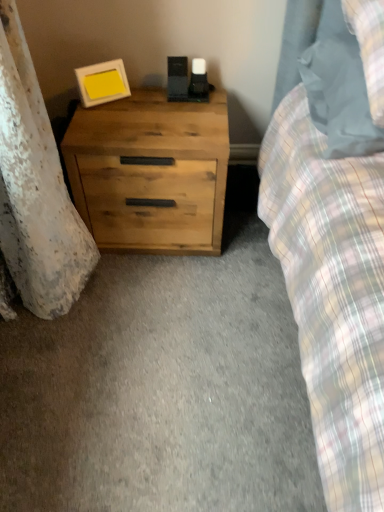
Question: From a real-world perspective, is matte gray pillow at upper right physically below natural wood chest of drawers at lower left?

Choices:
 (A) yes
 (B) no

Answer: (B)

Question: Considering the relative sizes of matte gray pillow at upper right and natural wood chest of drawers at lower left in the image provided, is matte gray pillow at upper right smaller than natural wood chest of drawers at lower left?

Choices:
 (A) no
 (B) yes

Answer: (B)

Question: From the image's perspective, does matte gray pillow at upper right appear lower than natural wood chest of drawers at lower left?

Choices:
 (A) yes
 (B) no

Answer: (B)

Question: Is matte gray pillow at upper right shorter than natural wood chest of drawers at lower left?

Choices:
 (A) yes
 (B) no

Answer: (A)

Question: Is there a large distance between matte gray pillow at upper right and natural wood chest of drawers at lower left?

Choices:
 (A) yes
 (B) no

Answer: (B)

Question: Is natural wood chest of drawers at lower left inside the boundaries of matte white picture frame at upper left, or outside?

Choices:
 (A) inside
 (B) outside

Answer: (B)

Question: Is natural wood chest of drawers at lower left taller or shorter than matte white picture frame at upper left?

Choices:
 (A) tall
 (B) short

Answer: (A)

Question: Looking at their shapes, would you say natural wood chest of drawers at lower left is wider or thinner than matte white picture frame at upper left?

Choices:
 (A) wide
 (B) thin

Answer: (A)

Question: In terms of size, does natural wood chest of drawers at lower left appear bigger or smaller than matte white picture frame at upper left?

Choices:
 (A) small
 (B) big

Answer: (B)

Question: In terms of height, does matte gray pillow at upper right look taller or shorter compared to natural wood chest of drawers at lower left?

Choices:
 (A) tall
 (B) short

Answer: (B)

Question: From a real-world perspective, is matte gray pillow at upper right positioned above or below natural wood chest of drawers at lower left?

Choices:
 (A) below
 (B) above

Answer: (B)

Question: Considering the positions of point (342, 23) and point (162, 227), is point (342, 23) closer or farther from the camera than point (162, 227)?

Choices:
 (A) farther
 (B) closer

Answer: (B)

Question: Considering the positions of matte gray pillow at upper right and natural wood chest of drawers at lower left in the image, is matte gray pillow at upper right wider or thinner than natural wood chest of drawers at lower left?

Choices:
 (A) thin
 (B) wide

Answer: (B)

Question: From a real-world perspective, is matte white picture frame at upper left positioned above or below natural wood chest of drawers at lower left?

Choices:
 (A) below
 (B) above

Answer: (B)

Question: In the image, is matte white picture frame at upper left on the left side or the right side of natural wood chest of drawers at lower left?

Choices:
 (A) left
 (B) right

Answer: (A)